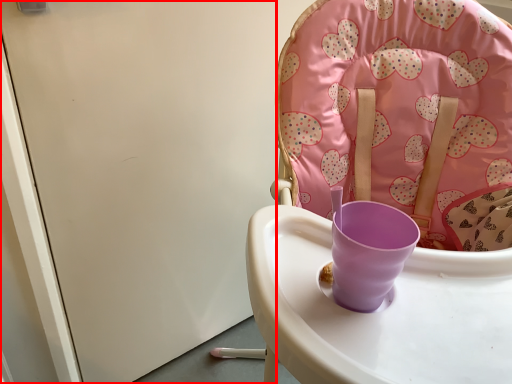
Question: From the image's perspective, where is screen door (annotated by the red box) located in relation to chair in the image?

Choices:
 (A) above
 (B) below

Answer: (A)